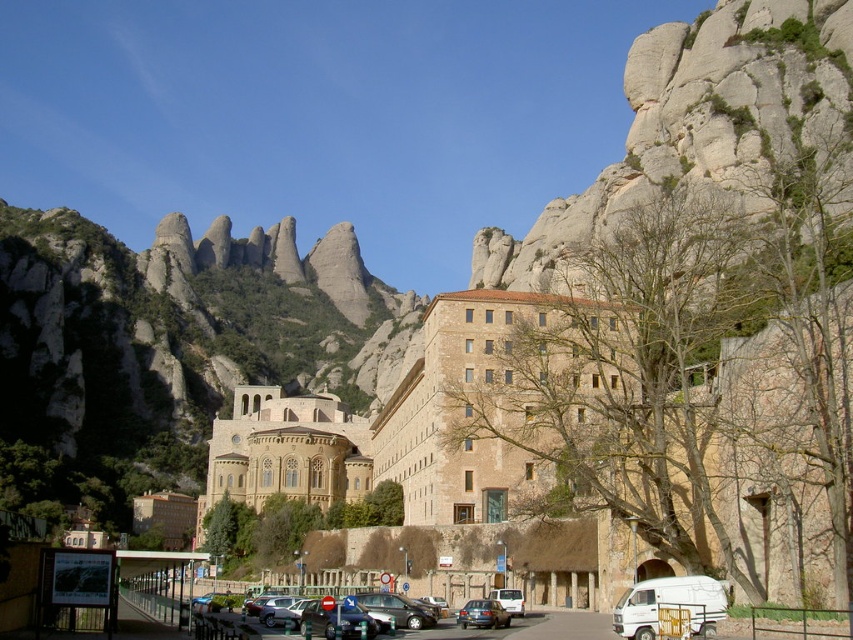
Which is more to the left, brown stone building at center or matte black sedan at center?

Positioned to the left is brown stone building at center.

Between brown stone building at center and matte black sedan at center, which one appears on the right side from the viewer's perspective?

From the viewer's perspective, matte black sedan at center appears more on the right side.

Is point (453, 362) in front of point (465, 627)?

No, (453, 362) is behind (465, 627).

Where is `brown stone building at center`? Image resolution: width=853 pixels, height=640 pixels. brown stone building at center is located at coordinates (392, 428).

Which is above, brown stone building at center or matte black car at center?

brown stone building at center is higher up.

Who is more distant from viewer, (451, 300) or (285, 609)?

The point (451, 300) is more distant.

Find the location of a particular element. The height and width of the screenshot is (640, 853). brown stone building at center is located at coordinates (392, 428).

In the scene shown: Who is more forward, (668, 604) or (490, 612)?

Positioned in front is point (668, 604).

Which of these two, white matte camper van at lower right or matte black sedan at center, stands taller?

Standing taller between the two is white matte camper van at lower right.

Describe the element at coordinates (669, 605) in the screenshot. I see `white matte camper van at lower right` at that location.

Find the location of `white matte camper van at lower right`. white matte camper van at lower right is located at coordinates (669, 605).